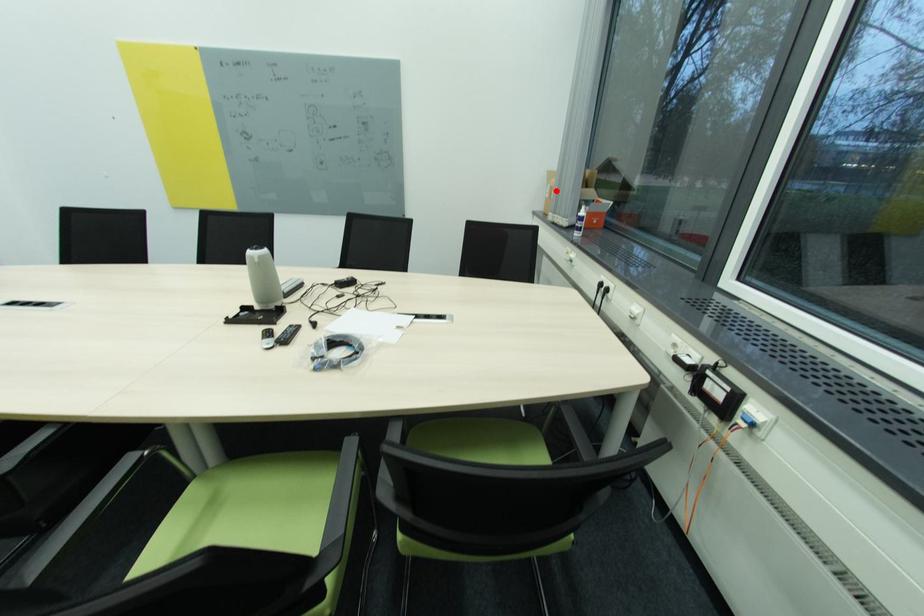
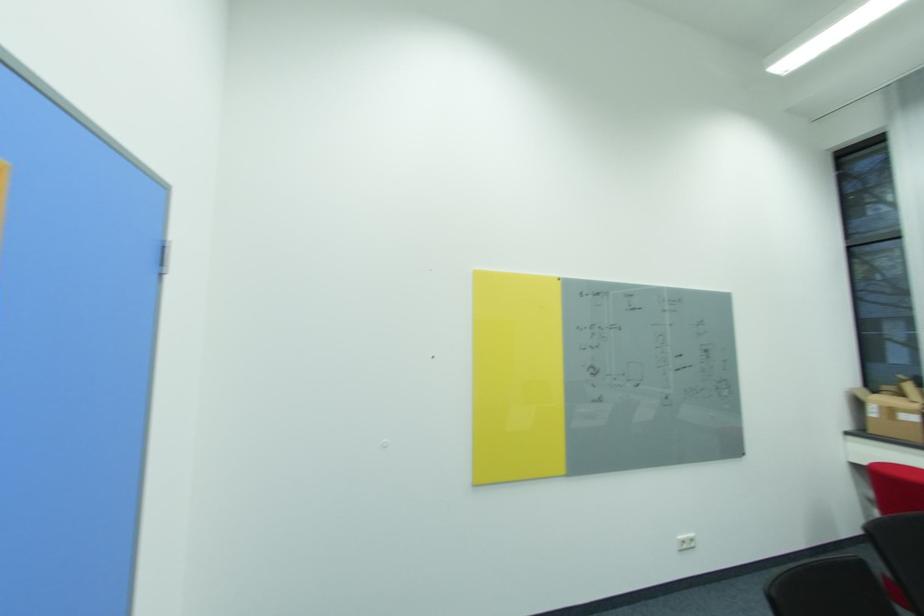
In the second image, find the point that corresponds to the highlighted location in the first image.

(895, 411)